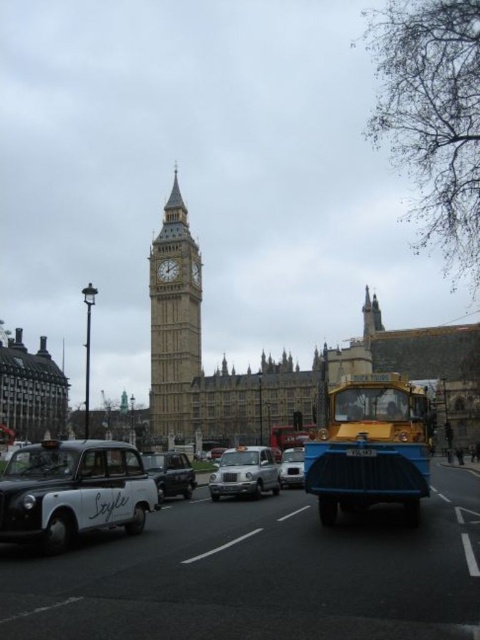
You are a tourist standing on the sidewalk in front of Big Ben. You see a yellow matte taxi at center and a black plastic license plate at center. Which object is nearer to you?

The yellow matte taxi at center is closer to the viewer than the black plastic license plate at center.

You are a tourist standing at the center of the street in front of the Elizabeth Tower. You want to take a photo of the yellow matte taxi at center. Where should you position yourself to capture the taxi in the frame?

To capture the yellow matte taxi at center in the frame, you should position yourself at the center of the street since the taxi is located at point (371,448), which is near the center.